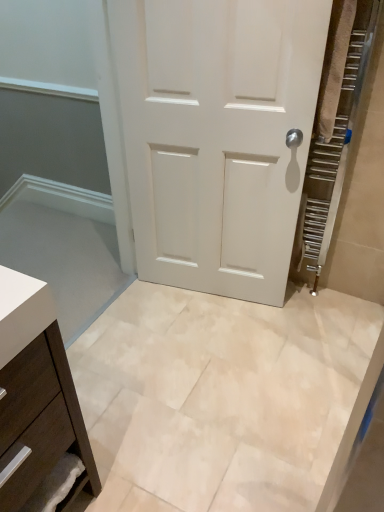
You are a GUI agent. You are given a task and a screenshot of the screen. Output one action in this format:
    pyautogui.click(x=<x>, y=<y>)
    Task: Click on the vacant space underneath white matte door at center (from a real-world perspective)
    This screenshot has height=512, width=384.
    Given the screenshot: What is the action you would take?
    pyautogui.click(x=217, y=297)